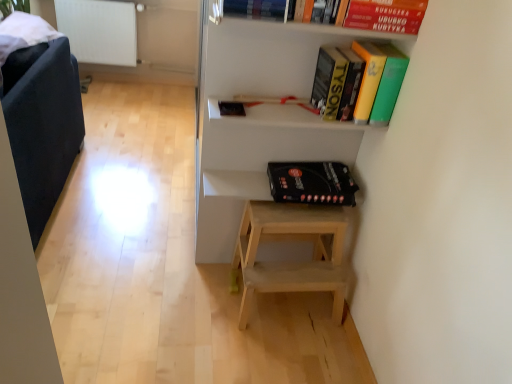
Question: Is white matte shelf at upper center far from hardcover book at upper center, which appears as the 2th book when viewed from the right?

Choices:
 (A) yes
 (B) no

Answer: (B)

Question: Can you confirm if white matte shelf at upper center is positioned to the right of hardcover book at upper center, acting as the 2th book starting from the bottom?

Choices:
 (A) yes
 (B) no

Answer: (A)

Question: Can you confirm if white matte shelf at upper center is smaller than hardcover book at upper center, which appears as the 2th book when viewed from the right?

Choices:
 (A) no
 (B) yes

Answer: (A)

Question: From a real-world perspective, does white matte shelf at upper center sit lower than hardcover book at upper center, placed as the first book when sorted from top to bottom?

Choices:
 (A) no
 (B) yes

Answer: (B)

Question: From the image's perspective, is white matte shelf at upper center above hardcover book at upper center, placed as the first book when sorted from top to bottom?

Choices:
 (A) no
 (B) yes

Answer: (A)

Question: From a real-world perspective, relative to hardcover book at upper center, which ranks as the 1th book in left-to-right order, is white matte shelf at upper center vertically above or below?

Choices:
 (A) below
 (B) above

Answer: (A)

Question: Based on their sizes in the image, would you say white matte shelf at upper center is bigger or smaller than hardcover book at upper center, which appears as the 2th book when viewed from the right?

Choices:
 (A) big
 (B) small

Answer: (A)

Question: Is point (215, 36) positioned closer to the camera than point (282, 16)?

Choices:
 (A) farther
 (B) closer

Answer: (A)

Question: Looking at their shapes, would you say white matte shelf at upper center is wider or thinner than hardcover book at upper center, placed as the first book when sorted from top to bottom?

Choices:
 (A) wide
 (B) thin

Answer: (B)

Question: From a real-world perspective, is white matte shelf at upper center positioned above or below yellow matte book at upper center, the 1th book when ordered from bottom to top?

Choices:
 (A) below
 (B) above

Answer: (A)

Question: From the image's perspective, is white matte shelf at upper center positioned above or below yellow matte book at upper center, which ranks as the 2th book in left-to-right order?

Choices:
 (A) below
 (B) above

Answer: (A)

Question: Considering the relative positions of white matte shelf at upper center and yellow matte book at upper center, which ranks as the 2th book in left-to-right order, in the image provided, is white matte shelf at upper center to the left or to the right of yellow matte book at upper center, which ranks as the 2th book in left-to-right order,?

Choices:
 (A) left
 (B) right

Answer: (A)

Question: Looking at the image, does white matte shelf at upper center seem bigger or smaller compared to yellow matte book at upper center, the 1th book when ordered from bottom to top?

Choices:
 (A) small
 (B) big

Answer: (B)

Question: Is point (407, 3) closer or farther from the camera than point (238, 69)?

Choices:
 (A) closer
 (B) farther

Answer: (A)

Question: Based on their positions, is red matte paperback book at upper right, which is the second paperback book from back to front, located to the left or right of white matte shelf at upper center?

Choices:
 (A) left
 (B) right

Answer: (B)